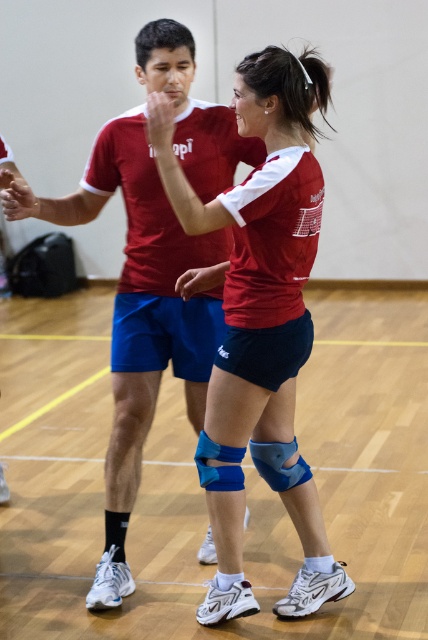
Question: Can you confirm if blue matte knee pads at center is positioned to the right of matte red shirt at center?

Choices:
 (A) no
 (B) yes

Answer: (B)

Question: Which point is farther to the camera?

Choices:
 (A) matte red shirt at center
 (B) blue matte knee pads at center

Answer: (A)

Question: Is blue matte knee pads at center positioned in front of matte red shirt at center?

Choices:
 (A) no
 (B) yes

Answer: (B)

Question: Which point appears closest to the camera in this image?

Choices:
 (A) (139, 476)
 (B) (282, 227)

Answer: (B)

Question: Can you confirm if blue matte knee pads at center is positioned above matte red shirt at center?

Choices:
 (A) no
 (B) yes

Answer: (A)